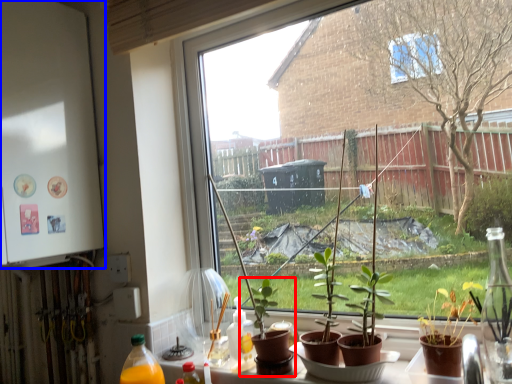
Question: Which object appears farthest to the camera in this image, houseplant (highlighted by a red box) or back (highlighted by a blue box)?

Choices:
 (A) houseplant
 (B) back

Answer: (B)